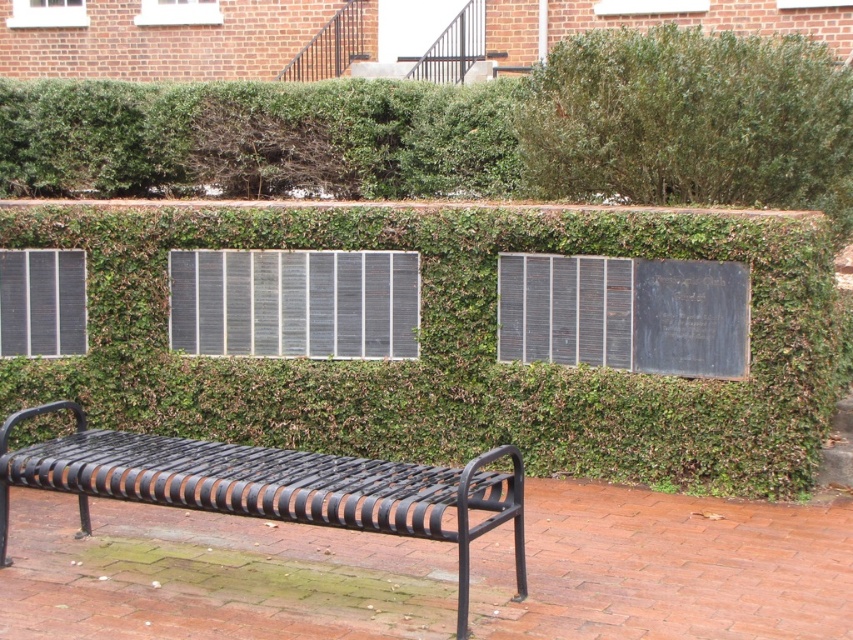
You are a gardener planning to trim the green leafy hedge at center and the green leafy hedge at upper right. Which hedge requires more time to trim based on their sizes?

The green leafy hedge at upper right requires more time to trim since it is larger than the green leafy hedge at center.

You are standing in front of the brick wall with ivy and plaques, and you see two points marked on the image at coordinates point (x=276, y=92) and point (x=79, y=502). Which point is closer to you?

Point (x=276, y=92) is further to the camera than point (x=79, y=502), so the point closer to you is point (x=79, y=502).